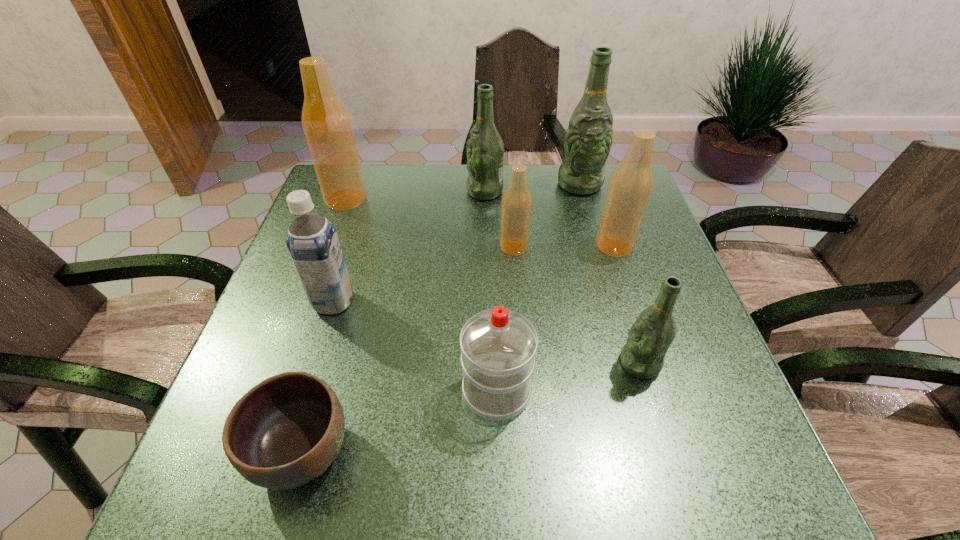
What are the coordinates of `bowl` in the screenshot? It's located at (284, 432).

The width and height of the screenshot is (960, 540). What are the coordinates of `free spot located on the surface of the biggest green beer bottle` in the screenshot? It's located at (605, 271).

Locate an element on the screen. The width and height of the screenshot is (960, 540). vacant space located 0.170m on the right of the leftmost beer bottle is located at coordinates (427, 199).

Where is `vacant space situated on the surface of the second smallest green beer bottle`? The width and height of the screenshot is (960, 540). vacant space situated on the surface of the second smallest green beer bottle is located at coordinates (359, 191).

Find the location of a particular element. vacant space located 0.220m on the surface of the second smallest green beer bottle is located at coordinates (390, 191).

Locate an element on the screen. vacant space located 0.350m on the surface of the second smallest green beer bottle is located at coordinates (346, 191).

Identify the location of vacant space situated on the back of the second smallest tan beer bottle. The image size is (960, 540). (598, 197).

Find the location of a particular element. free space located 0.180m on the label of the soya milk is located at coordinates (434, 302).

Identify the location of vacant space positioned 0.280m on the left of the smallest tan beer bottle. point(387,247).

The image size is (960, 540). What are the coordinates of `free region located 0.050m on the surface of the nearest green beer bottle` in the screenshot? It's located at click(x=593, y=363).